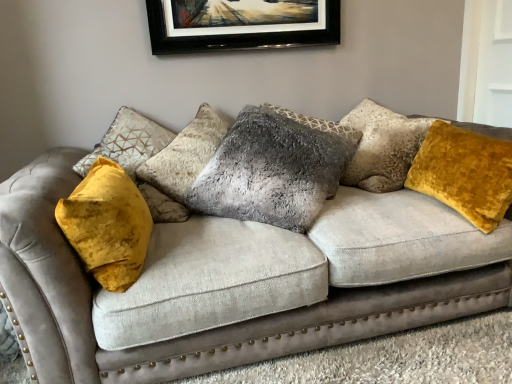
Measure the distance between point [241,137] and camera.

Point [241,137] is 1.84 meters away from camera.

The image size is (512, 384). I want to click on velvet gray couch at center, so click(236, 282).

The height and width of the screenshot is (384, 512). I want to click on studio couch located on the left of fuzzy gray pillow at center, marked as the second pillow in a right-to-left arrangement, so click(x=236, y=282).

Which object is positioned more to the left, fuzzy gray pillow at center, marked as the second pillow in a right-to-left arrangement, or velvet gray couch at center?

velvet gray couch at center is more to the left.

Can you see fuzzy gray pillow at center, marked as the second pillow in a right-to-left arrangement, touching velvet gray couch at center?

They are not placed beside each other.

From a real-world perspective, relative to velvet gray couch at center, is fuzzy gray pillow at center, arranged as the 1th pillow when viewed from the left, vertically above or below?

Clearly, from a real-world perspective, fuzzy gray pillow at center, arranged as the 1th pillow when viewed from the left, is above velvet gray couch at center.

Is velvet gray couch at center outside of velvet yellow pillow at right, which ranks as the 2th pillow in left-to-right order?

Yes, velvet gray couch at center is not within velvet yellow pillow at right, which ranks as the 2th pillow in left-to-right order.

Is velvet gray couch at center oriented towards velvet yellow pillow at right, which ranks as the 2th pillow in left-to-right order?

Yes, velvet gray couch at center is facing velvet yellow pillow at right, which ranks as the 2th pillow in left-to-right order.

Is the surface of velvet gray couch at center in direct contact with velvet yellow pillow at right, placed as the first pillow when sorted from right to left?

No.

Looking at their sizes, would you say velvet gray couch at center is wider or thinner than velvet yellow pillow at right, placed as the first pillow when sorted from right to left?

Clearly, velvet gray couch at center has more width compared to velvet yellow pillow at right, placed as the first pillow when sorted from right to left.

Is fuzzy gray pillow at center, marked as the second pillow in a right-to-left arrangement, spatially inside velvet yellow pillow at right, which ranks as the 2th pillow in left-to-right order, or outside of it?

fuzzy gray pillow at center, marked as the second pillow in a right-to-left arrangement, exists outside the volume of velvet yellow pillow at right, which ranks as the 2th pillow in left-to-right order.

Is fuzzy gray pillow at center, marked as the second pillow in a right-to-left arrangement, aimed at velvet yellow pillow at right, placed as the first pillow when sorted from right to left?

No.

Can you confirm if fuzzy gray pillow at center, arranged as the 1th pillow when viewed from the left, is positioned to the right of velvet yellow pillow at right, placed as the first pillow when sorted from right to left?

In fact, fuzzy gray pillow at center, arranged as the 1th pillow when viewed from the left, is to the left of velvet yellow pillow at right, placed as the first pillow when sorted from right to left.

Find the location of a particular element. Image resolution: width=512 pixels, height=384 pixels. pillow behind the velvet yellow pillow at right, placed as the first pillow when sorted from right to left is located at coordinates (271, 171).

From the image's perspective, would you say velvet gray couch at center is shown under fuzzy gray pillow at center, arranged as the 1th pillow when viewed from the left?

Yes, from the image's perspective, velvet gray couch at center is below fuzzy gray pillow at center, arranged as the 1th pillow when viewed from the left.

Can you confirm if velvet gray couch at center is bigger than fuzzy gray pillow at center, arranged as the 1th pillow when viewed from the left?

Correct, velvet gray couch at center is larger in size than fuzzy gray pillow at center, arranged as the 1th pillow when viewed from the left.

Do you think velvet gray couch at center is within fuzzy gray pillow at center, arranged as the 1th pillow when viewed from the left, or outside of it?

velvet gray couch at center is located beyond the bounds of fuzzy gray pillow at center, arranged as the 1th pillow when viewed from the left.

Between point (424, 286) and point (277, 124), which one is positioned in front?

Positioned in front is point (424, 286).

Which of these two, velvet yellow pillow at right, placed as the first pillow when sorted from right to left, or velvet gray couch at center, stands shorter?

velvet yellow pillow at right, placed as the first pillow when sorted from right to left, is shorter.

From a real-world perspective, which is physically above, velvet yellow pillow at right, which ranks as the 2th pillow in left-to-right order, or velvet gray couch at center?

velvet yellow pillow at right, which ranks as the 2th pillow in left-to-right order, from a real-world perspective.

From the picture: Is velvet yellow pillow at right, which ranks as the 2th pillow in left-to-right order, wider than velvet gray couch at center?

No.

Locate an element on the screen. Image resolution: width=512 pixels, height=384 pixels. the 2nd pillow to the right of the velvet gray couch at center, counting from the anchor's position is located at coordinates (465, 173).

Which of these two, velvet yellow pillow at right, placed as the first pillow when sorted from right to left, or fuzzy gray pillow at center, marked as the second pillow in a right-to-left arrangement, is bigger?

fuzzy gray pillow at center, marked as the second pillow in a right-to-left arrangement, is bigger.

Between velvet yellow pillow at right, placed as the first pillow when sorted from right to left, and fuzzy gray pillow at center, arranged as the 1th pillow when viewed from the left, which one appears on the left side from the viewer's perspective?

fuzzy gray pillow at center, arranged as the 1th pillow when viewed from the left, is more to the left.

Considering the relative positions of velvet yellow pillow at right, placed as the first pillow when sorted from right to left, and fuzzy gray pillow at center, arranged as the 1th pillow when viewed from the left, in the image provided, is velvet yellow pillow at right, placed as the first pillow when sorted from right to left, behind fuzzy gray pillow at center, arranged as the 1th pillow when viewed from the left,?

No, velvet yellow pillow at right, placed as the first pillow when sorted from right to left, is in front of fuzzy gray pillow at center, arranged as the 1th pillow when viewed from the left.

Can you confirm if velvet yellow pillow at right, which ranks as the 2th pillow in left-to-right order, is taller than fuzzy gray pillow at center, marked as the second pillow in a right-to-left arrangement?

No.

From a real-world perspective, which pillow is the 2nd one above the velvet gray couch at center? Please provide its 2D coordinates.

[(271, 171)]

Image resolution: width=512 pixels, height=384 pixels. In order to click on the 1st pillow behind the velvet gray couch at center in this screenshot , I will do `click(465, 173)`.

Which object lies nearer to the anchor point velvet gray couch at center, velvet yellow pillow at right, placed as the first pillow when sorted from right to left, or fuzzy gray pillow at center, arranged as the 1th pillow when viewed from the left?

fuzzy gray pillow at center, arranged as the 1th pillow when viewed from the left.

Based on their spatial positions, is fuzzy gray pillow at center, marked as the second pillow in a right-to-left arrangement, or velvet yellow pillow at right, which ranks as the 2th pillow in left-to-right order, further from velvet gray couch at center?

velvet yellow pillow at right, which ranks as the 2th pillow in left-to-right order, is positioned further to the anchor velvet gray couch at center.

Looking at the image, which one is located closer to velvet yellow pillow at right, which ranks as the 2th pillow in left-to-right order, fuzzy gray pillow at center, marked as the second pillow in a right-to-left arrangement, or velvet gray couch at center?

Based on the image, velvet gray couch at center appears to be nearer to velvet yellow pillow at right, which ranks as the 2th pillow in left-to-right order.

Considering their positions, is velvet gray couch at center positioned further to fuzzy gray pillow at center, marked as the second pillow in a right-to-left arrangement, than velvet yellow pillow at right, placed as the first pillow when sorted from right to left?

velvet yellow pillow at right, placed as the first pillow when sorted from right to left, is further to fuzzy gray pillow at center, marked as the second pillow in a right-to-left arrangement.

From the picture: Estimate the real-world distances between objects in this image. Which object is further from fuzzy gray pillow at center, arranged as the 1th pillow when viewed from the left, velvet yellow pillow at right, which ranks as the 2th pillow in left-to-right order, or velvet gray couch at center?

velvet yellow pillow at right, which ranks as the 2th pillow in left-to-right order, is further to fuzzy gray pillow at center, arranged as the 1th pillow when viewed from the left.

Estimate the real-world distances between objects in this image. Which object is further from velvet yellow pillow at right, placed as the first pillow when sorted from right to left, velvet gray couch at center or fuzzy gray pillow at center, marked as the second pillow in a right-to-left arrangement?

fuzzy gray pillow at center, marked as the second pillow in a right-to-left arrangement, lies further to velvet yellow pillow at right, placed as the first pillow when sorted from right to left, than the other object.

In order to click on pillow between velvet gray couch at center and velvet yellow pillow at right, which ranks as the 2th pillow in left-to-right order, in the horizontal direction in this screenshot , I will do `click(271, 171)`.